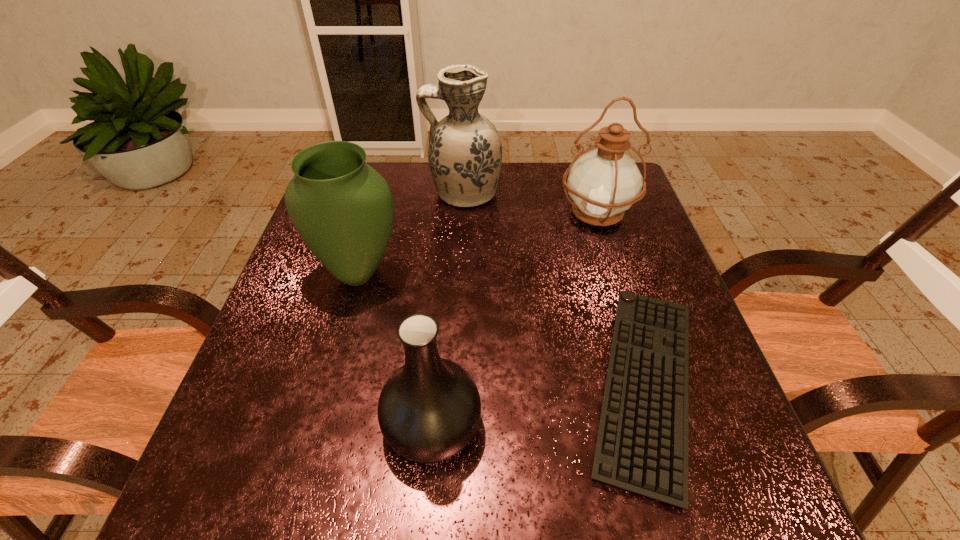
Where is `vacant space that satisfies the following two spatial constraints: 1. on the back side of the oil lamp; 2. on the left side of the shortest object`? This screenshot has height=540, width=960. vacant space that satisfies the following two spatial constraints: 1. on the back side of the oil lamp; 2. on the left side of the shortest object is located at coordinates (594, 214).

The width and height of the screenshot is (960, 540). What are the coordinates of `free location that satisfies the following two spatial constraints: 1. on the back side of the leftmost object; 2. on the right side of the oil lamp` in the screenshot? It's located at (375, 214).